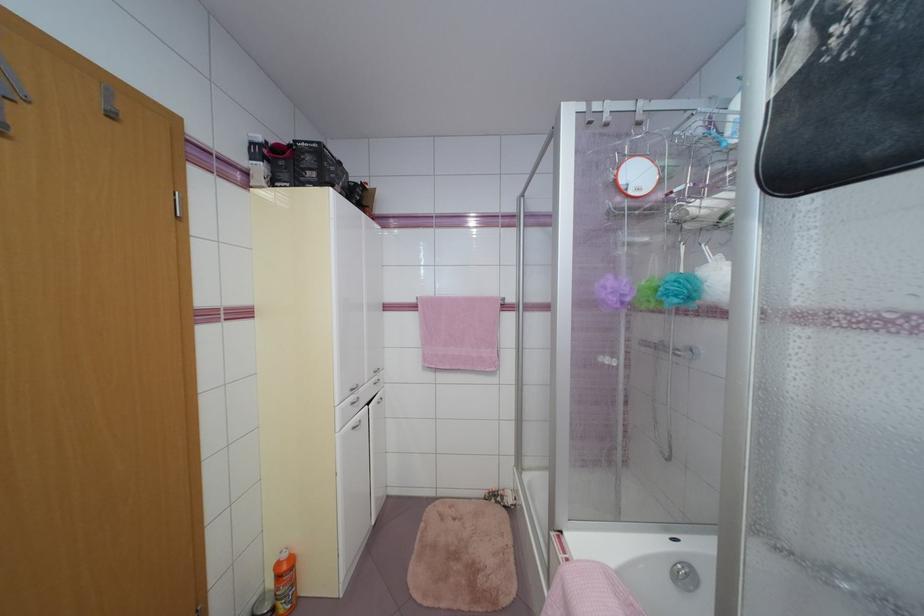
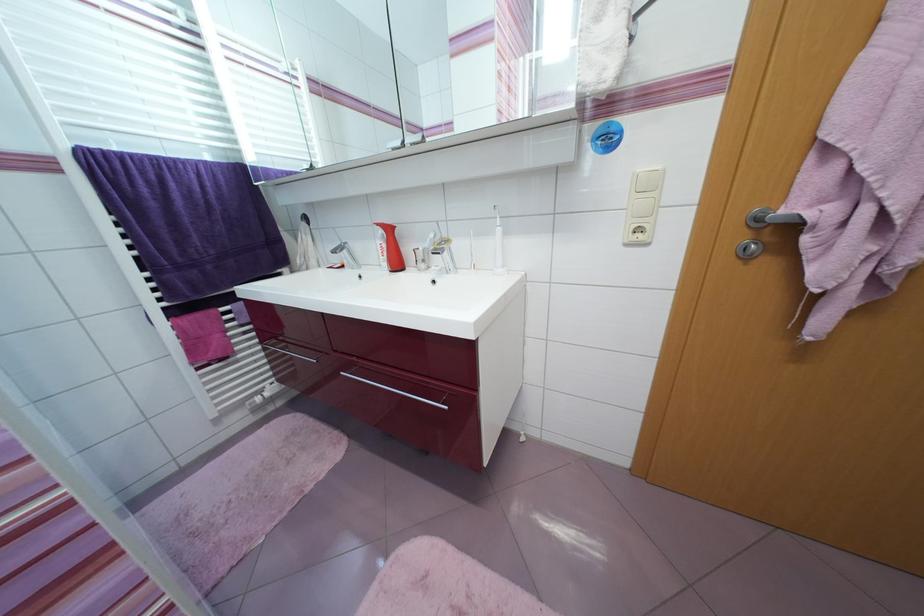
Based on the continuous images, in which direction is the camera rotating?

The rotation direction of the camera is left-down.